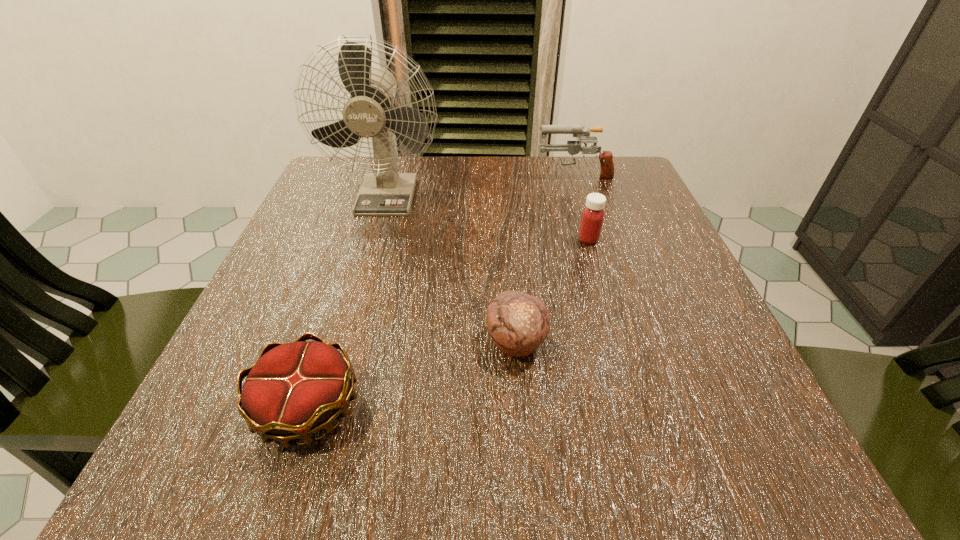
Where is `the tallest object`? The width and height of the screenshot is (960, 540). the tallest object is located at coordinates (370, 112).

Find the location of a particular element. This screenshot has width=960, height=540. gun is located at coordinates (573, 147).

Identify the location of the third nearest object. The width and height of the screenshot is (960, 540). (592, 218).

Find the location of `the third object from right to left`. the third object from right to left is located at coordinates (518, 322).

Where is `crown`? crown is located at coordinates (296, 389).

The image size is (960, 540). Identify the location of vacant area situated 0.230m on the air flow direction of the fan. (357, 298).

You are a GUI agent. You are given a task and a screenshot of the screen. Output one action in this format:
    pyautogui.click(x=<x>, y=<y>)
    Task: Click on the vacant space located 0.160m at the barrel end of the fourth shortest object
    This screenshot has height=540, width=960.
    Given the screenshot: What is the action you would take?
    pyautogui.click(x=468, y=174)

Locate an element on the screen. The height and width of the screenshot is (540, 960). blank space located at the barrel end of the fourth shortest object is located at coordinates (490, 174).

Where is `free space located at the barrel end of the fourth shortest object`? This screenshot has height=540, width=960. free space located at the barrel end of the fourth shortest object is located at coordinates (502, 174).

Identify the location of vacant region located 0.140m on the left of the medicine. Image resolution: width=960 pixels, height=540 pixels. (505, 239).